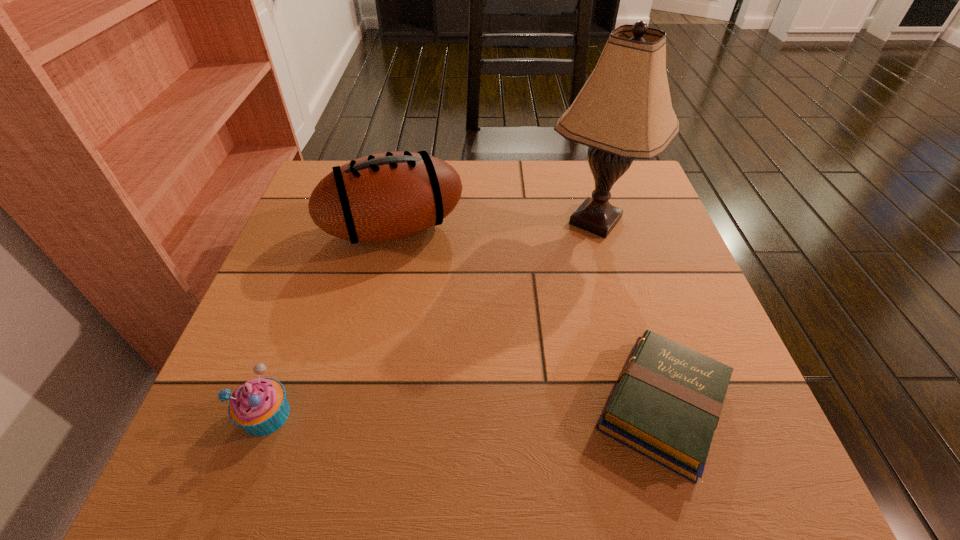
The height and width of the screenshot is (540, 960). In order to click on free region at the far edge of the desktop in this screenshot , I will do `click(569, 187)`.

The image size is (960, 540). I want to click on vacant point at the left edge, so click(x=298, y=293).

In the image, there is a desktop. Identify the location of vacant space at the right edge. The height and width of the screenshot is (540, 960). (732, 384).

This screenshot has height=540, width=960. Identify the location of vacant region at the far left corner. (322, 166).

Find the location of a particular element. The image size is (960, 540). unoccupied position between the lamp and the football (American) is located at coordinates (494, 225).

I want to click on blank region between the lamp and the football (American), so click(x=494, y=225).

This screenshot has width=960, height=540. What are the coordinates of `free space between the shortest object and the third tallest object` in the screenshot? It's located at (465, 410).

The image size is (960, 540). I want to click on free space between the muffin and the third shortest object, so click(330, 322).

The image size is (960, 540). Find the location of `free space between the tallest object and the third tallest object`. free space between the tallest object and the third tallest object is located at coordinates (431, 318).

You are a GUI agent. You are given a task and a screenshot of the screen. Output one action in this format:
    pyautogui.click(x=<x>, y=<y>)
    Task: Click on the vacant region between the shortest object and the football (American)
    The image size is (960, 540).
    Given the screenshot: What is the action you would take?
    pyautogui.click(x=528, y=317)